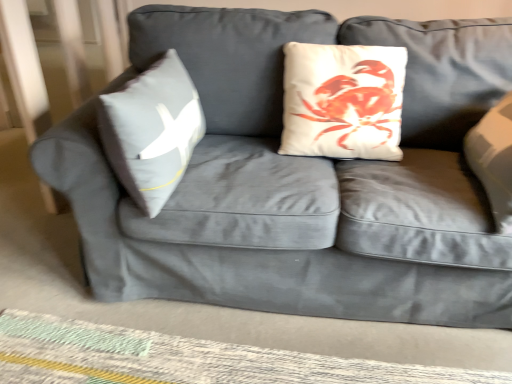
Question: From a real-world perspective, is woven fabric mat at lower center positioned over gray fabric pillow at left based on gravity?

Choices:
 (A) no
 (B) yes

Answer: (A)

Question: Is woven fabric mat at lower center completely or partially outside of gray fabric pillow at left?

Choices:
 (A) yes
 (B) no

Answer: (A)

Question: Considering the relative positions of woven fabric mat at lower center and gray fabric pillow at left in the image provided, is woven fabric mat at lower center to the right of gray fabric pillow at left from the viewer's perspective?

Choices:
 (A) yes
 (B) no

Answer: (A)

Question: Is woven fabric mat at lower center not near gray fabric pillow at left?

Choices:
 (A) yes
 (B) no

Answer: (B)

Question: Can you confirm if woven fabric mat at lower center is smaller than gray fabric pillow at left?

Choices:
 (A) yes
 (B) no

Answer: (A)

Question: Is woven fabric mat at lower center further to the viewer compared to gray fabric pillow at left?

Choices:
 (A) yes
 (B) no

Answer: (A)

Question: Can you confirm if gray fabric pillow at left is shorter than woven fabric mat at lower center?

Choices:
 (A) no
 (B) yes

Answer: (A)

Question: Is gray fabric pillow at left with woven fabric mat at lower center?

Choices:
 (A) yes
 (B) no

Answer: (B)

Question: Does gray fabric pillow at left appear on the right side of woven fabric mat at lower center?

Choices:
 (A) no
 (B) yes

Answer: (A)

Question: Is gray fabric pillow at left facing away from woven fabric mat at lower center?

Choices:
 (A) yes
 (B) no

Answer: (B)

Question: From a real-world perspective, is gray fabric pillow at left positioned over woven fabric mat at lower center based on gravity?

Choices:
 (A) yes
 (B) no

Answer: (A)

Question: From a real-world perspective, is gray fabric pillow at left positioned under woven fabric mat at lower center based on gravity?

Choices:
 (A) yes
 (B) no

Answer: (B)

Question: In terms of width, does woven fabric mat at lower center look wider or thinner when compared to gray fabric pillow at left?

Choices:
 (A) wide
 (B) thin

Answer: (A)